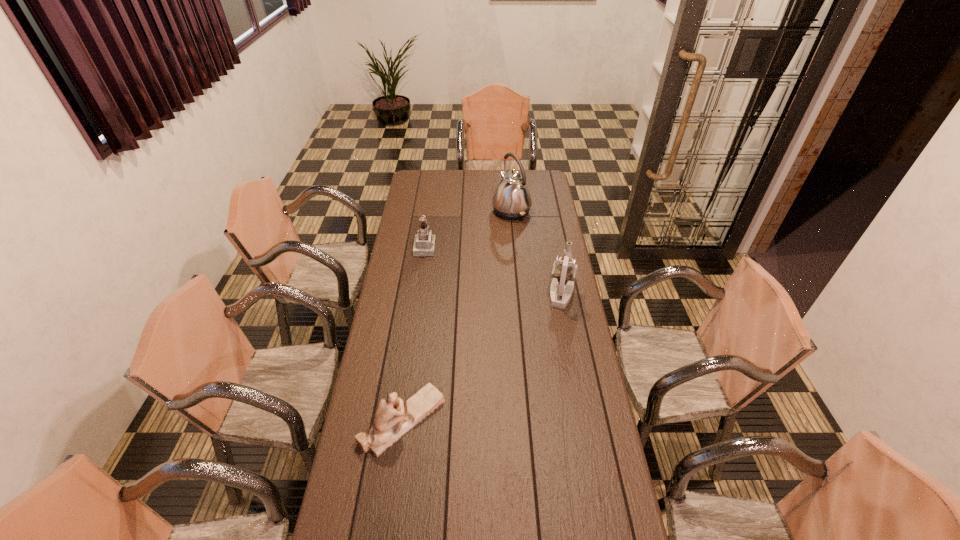
The image size is (960, 540). Identify the location of free space between the farthest object and the farther figurine. (468, 229).

The height and width of the screenshot is (540, 960). In order to click on object that ranks as the third closest to the second farthest object in this screenshot , I will do `click(393, 418)`.

The image size is (960, 540). Find the location of `object that is the closest to the nearer figurine`. object that is the closest to the nearer figurine is located at coordinates (564, 270).

Locate an element on the screen. vacant space that satisfies the following two spatial constraints: 1. on the front side of the third shortest object; 2. on the front-facing side of the shortest object is located at coordinates (586, 420).

I want to click on blank area in the image that satisfies the following two spatial constraints: 1. on the front-facing side of the second farthest object; 2. on the right side of the rightmost object, so click(x=418, y=294).